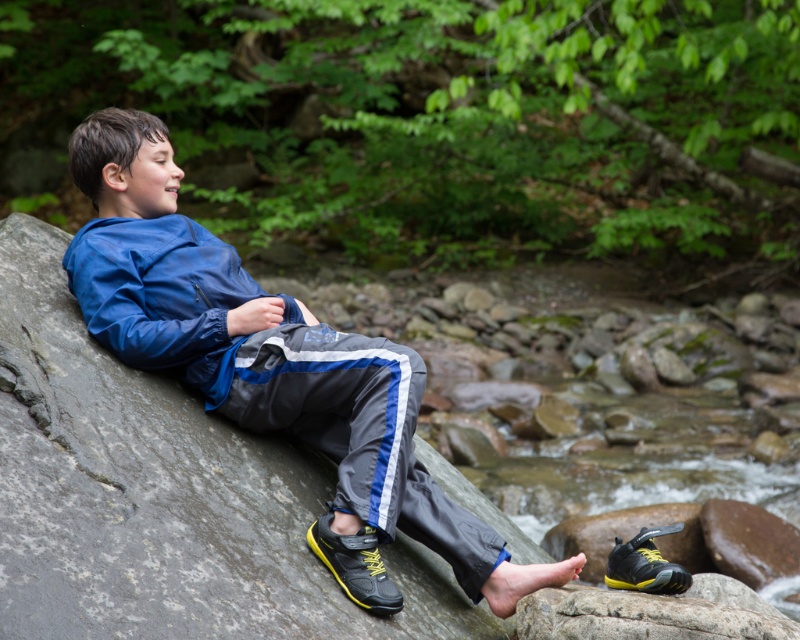
Question: Does matte blue jacket at center lie behind yellow matte shoe at lower right?

Choices:
 (A) no
 (B) yes

Answer: (B)

Question: Among these objects, which one is nearest to the camera?

Choices:
 (A) yellow matte shoe at lower right
 (B) blue synthetic jacket at upper left
 (C) black/yellow running shoe at lower center

Answer: (C)

Question: Which is farther from the yellow matte shoe at lower right?

Choices:
 (A) black/yellow running shoe at lower center
 (B) matte blue jacket at center

Answer: (B)

Question: Does matte blue jacket at center appear under blue synthetic jacket at upper left?

Choices:
 (A) no
 (B) yes

Answer: (B)

Question: Which of the following is the closest to the observer?

Choices:
 (A) matte blue jacket at center
 (B) black/yellow running shoe at lower center
 (C) blue synthetic jacket at upper left

Answer: (B)

Question: Can you confirm if black/yellow running shoe at lower center is positioned above yellow matte shoe at lower right?

Choices:
 (A) yes
 (B) no

Answer: (A)